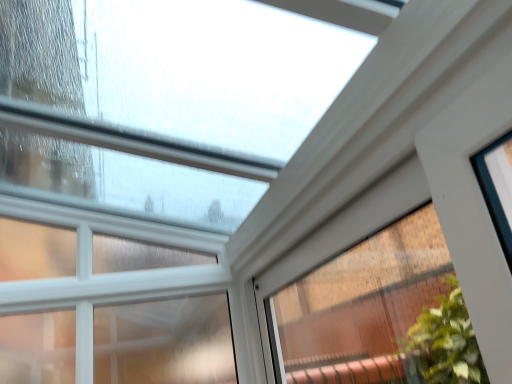
Locate an element on the screen. Image resolution: width=512 pixels, height=384 pixels. clear glass window at upper center, which is counted as the first window, starting from the left is located at coordinates (109, 307).

What is the approximate height of clear glass window at upper center, acting as the second window starting from the right?

The height of clear glass window at upper center, acting as the second window starting from the right, is 96.34 centimeters.

What do you see at coordinates (109, 307) in the screenshot?
I see `clear glass window at upper center, acting as the second window starting from the right` at bounding box center [109, 307].

The image size is (512, 384). Describe the element at coordinates (362, 305) in the screenshot. I see `clear glass window at upper center, which is counted as the 1th window, starting from the right` at that location.

Find the location of a particular element. This screenshot has width=512, height=384. clear glass window at upper center, which is counted as the 1th window, starting from the right is located at coordinates (362, 305).

This screenshot has height=384, width=512. I want to click on clear glass window at upper center, which is counted as the first window, starting from the left, so click(109, 307).

Visually, is clear glass window at upper center, which is counted as the 1th window, starting from the right, positioned to the left or to the right of clear glass window at upper center, which is counted as the first window, starting from the left?

Based on their positions, clear glass window at upper center, which is counted as the 1th window, starting from the right, is located to the right of clear glass window at upper center, which is counted as the first window, starting from the left.

Which object is further away from the camera, clear glass window at upper center, which is counted as the 1th window, starting from the right, or clear glass window at upper center, which is counted as the first window, starting from the left?

clear glass window at upper center, which is counted as the first window, starting from the left, is behind.

Based on the photo, which is closer, (320, 352) or (206, 306)?

The point (206, 306) is closer to the camera.

From the image's perspective, is clear glass window at upper center, which is counted as the 1th window, starting from the right, over clear glass window at upper center, acting as the second window starting from the right?

Yes.

From a real-world perspective, who is located higher, clear glass window at upper center, the 2th window from the left, or clear glass window at upper center, acting as the second window starting from the right?

clear glass window at upper center, acting as the second window starting from the right, is physically above.

Which of these two, clear glass window at upper center, the 2th window from the left, or clear glass window at upper center, acting as the second window starting from the right, is wider?

clear glass window at upper center, acting as the second window starting from the right, is wider.

Looking at this image, considering the relative sizes of clear glass window at upper center, which is counted as the 1th window, starting from the right, and clear glass window at upper center, which is counted as the first window, starting from the left, in the image provided, is clear glass window at upper center, which is counted as the 1th window, starting from the right, taller than clear glass window at upper center, which is counted as the first window, starting from the left,?

No, clear glass window at upper center, which is counted as the 1th window, starting from the right, is not taller than clear glass window at upper center, which is counted as the first window, starting from the left.

Considering the sizes of clear glass window at upper center, which is counted as the 1th window, starting from the right, and clear glass window at upper center, which is counted as the first window, starting from the left, in the image, is clear glass window at upper center, which is counted as the 1th window, starting from the right, bigger or smaller than clear glass window at upper center, which is counted as the first window, starting from the left,?

In the image, clear glass window at upper center, which is counted as the 1th window, starting from the right, appears to be smaller than clear glass window at upper center, which is counted as the first window, starting from the left.

Is clear glass window at upper center, which is counted as the 1th window, starting from the right, located outside clear glass window at upper center, which is counted as the first window, starting from the left?

clear glass window at upper center, which is counted as the 1th window, starting from the right, is positioned outside clear glass window at upper center, which is counted as the first window, starting from the left.

Is clear glass window at upper center, which is counted as the 1th window, starting from the right, not close to clear glass window at upper center, which is counted as the first window, starting from the left?

No, clear glass window at upper center, which is counted as the 1th window, starting from the right, is not far away from clear glass window at upper center, which is counted as the first window, starting from the left.

Is clear glass window at upper center, the 2th window from the left, oriented towards clear glass window at upper center, acting as the second window starting from the right?

Yes.

At what (x,y) coordinates should I click in order to perform the action: click on window below the clear glass window at upper center, acting as the second window starting from the right (from a real-world perspective). Please return your answer as a coordinate pair (x, y). This screenshot has height=384, width=512. Looking at the image, I should click on (362, 305).

Which object is positioned more to the right, clear glass window at upper center, acting as the second window starting from the right, or clear glass window at upper center, which is counted as the 1th window, starting from the right?

clear glass window at upper center, which is counted as the 1th window, starting from the right.

Which is behind, clear glass window at upper center, which is counted as the first window, starting from the left, or clear glass window at upper center, which is counted as the 1th window, starting from the right?

clear glass window at upper center, which is counted as the first window, starting from the left, is behind.

Is point (206, 373) closer or farther from the camera than point (379, 234)?

Clearly, point (206, 373) is closer to the camera than point (379, 234).

From the image's perspective, which one is positioned lower, clear glass window at upper center, which is counted as the first window, starting from the left, or clear glass window at upper center, the 2th window from the left?

clear glass window at upper center, which is counted as the first window, starting from the left, is shown below in the image.

From a real-world perspective, is clear glass window at upper center, which is counted as the first window, starting from the left, positioned above or below clear glass window at upper center, the 2th window from the left?

From a real-world perspective, clear glass window at upper center, which is counted as the first window, starting from the left, is physically above clear glass window at upper center, the 2th window from the left.

Which object is wider, clear glass window at upper center, acting as the second window starting from the right, or clear glass window at upper center, the 2th window from the left?

clear glass window at upper center, acting as the second window starting from the right.

Looking at this image, does clear glass window at upper center, which is counted as the first window, starting from the left, have a lesser height compared to clear glass window at upper center, the 2th window from the left?

No.

Can you confirm if clear glass window at upper center, acting as the second window starting from the right, is bigger than clear glass window at upper center, the 2th window from the left?

Indeed, clear glass window at upper center, acting as the second window starting from the right, has a larger size compared to clear glass window at upper center, the 2th window from the left.

Do you think clear glass window at upper center, which is counted as the first window, starting from the left, is within clear glass window at upper center, the 2th window from the left, or outside of it?

clear glass window at upper center, which is counted as the first window, starting from the left, exists outside the volume of clear glass window at upper center, the 2th window from the left.

Is clear glass window at upper center, which is counted as the first window, starting from the left, in contact with clear glass window at upper center, which is counted as the 1th window, starting from the right?

clear glass window at upper center, which is counted as the first window, starting from the left, and clear glass window at upper center, which is counted as the 1th window, starting from the right, are clearly separated.

Is clear glass window at upper center, which is counted as the first window, starting from the left, oriented away from clear glass window at upper center, the 2th window from the left?

No, clear glass window at upper center, which is counted as the first window, starting from the left, is not facing the opposite direction of clear glass window at upper center, the 2th window from the left.

You are a GUI agent. You are given a task and a screenshot of the screen. Output one action in this format:
    pyautogui.click(x=<x>, y=<y>)
    Task: Click on the window that is under the clear glass window at upper center, which is counted as the first window, starting from the left (from a real-world perspective)
    
    Given the screenshot: What is the action you would take?
    pyautogui.click(x=362, y=305)

Where is `window lying behind the clear glass window at upper center, which is counted as the 1th window, starting from the right`? The image size is (512, 384). window lying behind the clear glass window at upper center, which is counted as the 1th window, starting from the right is located at coordinates (109, 307).

Where is `window directly beneath the clear glass window at upper center, which is counted as the first window, starting from the left (from a real-world perspective)`? window directly beneath the clear glass window at upper center, which is counted as the first window, starting from the left (from a real-world perspective) is located at coordinates (362, 305).